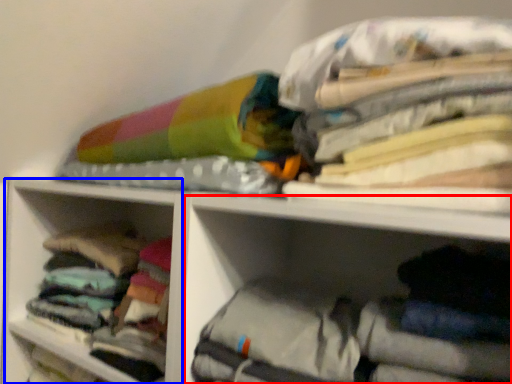
Question: Which of the following is the farthest to the observer, cabinet (highlighted by a red box) or cabinet (highlighted by a blue box)?

Choices:
 (A) cabinet
 (B) cabinet

Answer: (B)